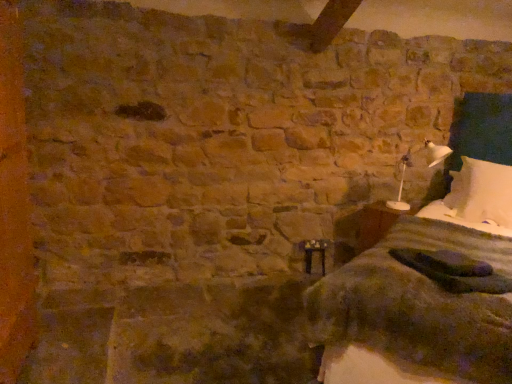
Question: Is white soft pillow at right in front of or behind white plastic lamp at right in the image?

Choices:
 (A) front
 (B) behind

Answer: (B)

Question: From a real-world perspective, relative to white plastic lamp at right, is white soft pillow at right vertically above or below?

Choices:
 (A) above
 (B) below

Answer: (B)

Question: Which of these objects is positioned farthest from the white soft pillow at right?

Choices:
 (A) white plastic lamp at right
 (B) white cotton bed at right
 (C) wooden bedside table at lower right

Answer: (A)

Question: Based on their relative distances, which object is nearer to the wooden bedside table at lower right?

Choices:
 (A) white soft pillow at right
 (B) white cotton bed at right
 (C) white plastic lamp at right

Answer: (C)